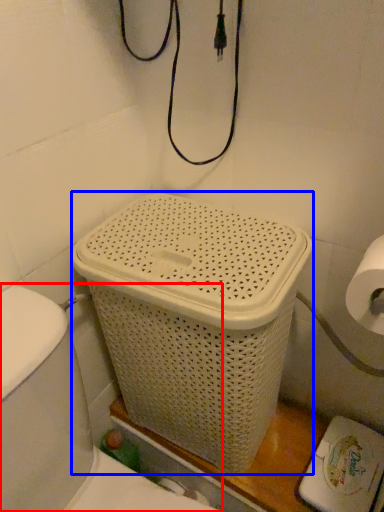
Question: Which object is further to the camera taking this photo, sink (highlighted by a red box) or basket container (highlighted by a blue box)?

Choices:
 (A) sink
 (B) basket container

Answer: (B)